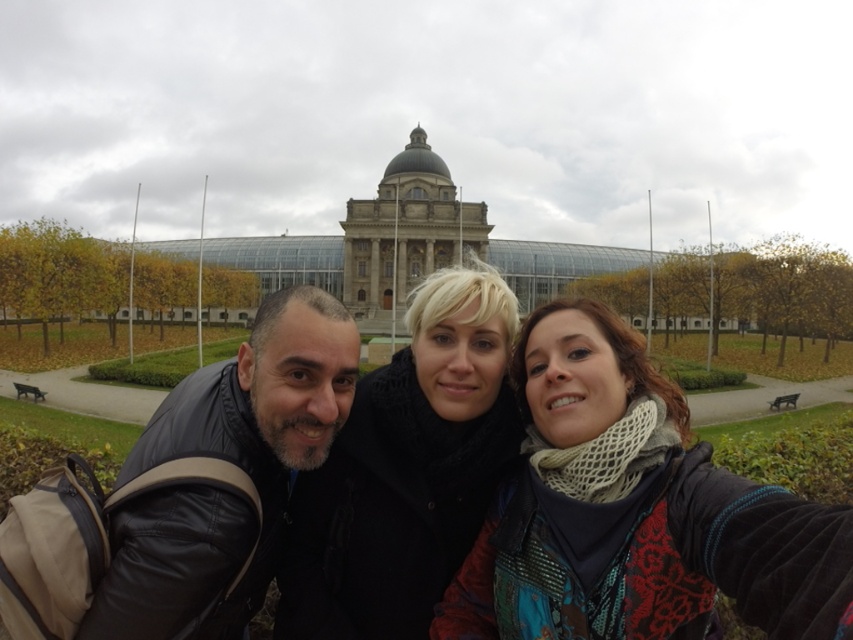
You are standing in front of the grand building with the dome. You see a point marked at coordinates (405,470). According to the image, where is this point located?

The point at (405,470) is located on the black woolen scarf at center.

You are a photographer trying to capture the three people in the scene. The black woolen scarf at center and the black leather jacket at lower left are both in the frame. Which item takes up more space in the photo?

The black woolen scarf at center takes up more space in the photo because it has a larger size compared to the black leather jacket at lower left.